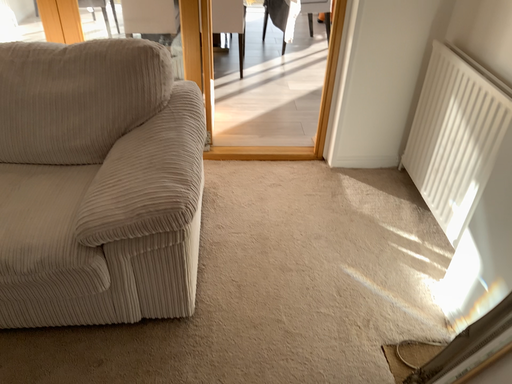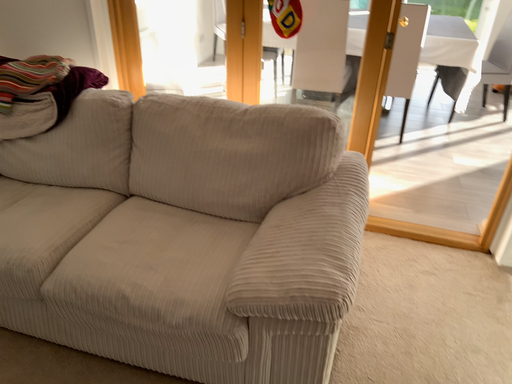
Question: Which way did the camera rotate in the video?

Choices:
 (A) rotated right
 (B) rotated left

Answer: (B)